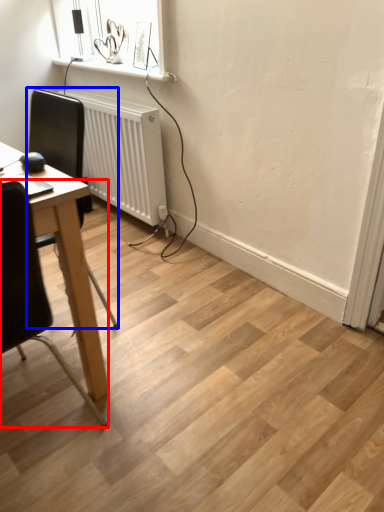
Question: Which point is further to the camera, chair (highlighted by a red box) or chair (highlighted by a blue box)?

Choices:
 (A) chair
 (B) chair

Answer: (B)